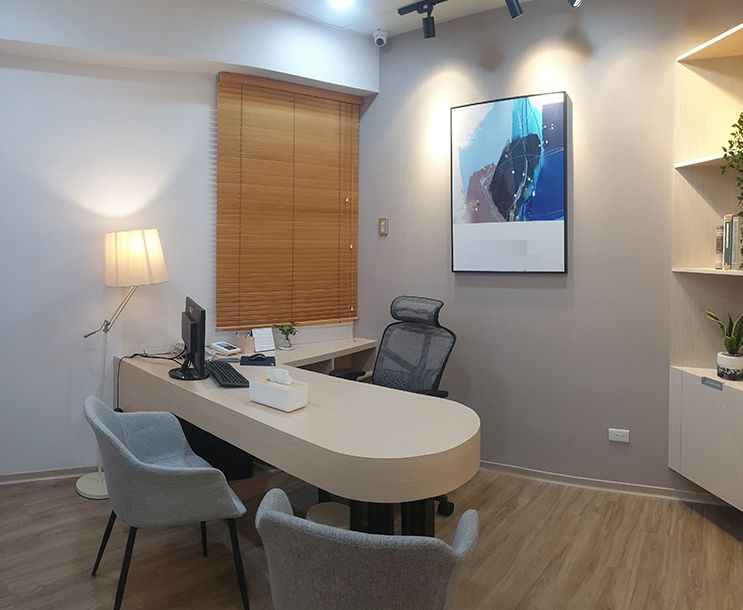
Locate an element on the screen. The width and height of the screenshot is (743, 610). keyboard is located at coordinates (224, 373).